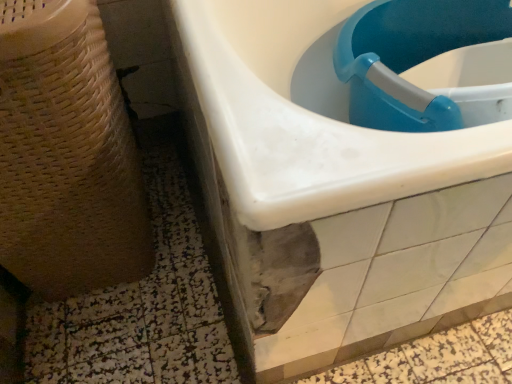
Question: From their relative heights in the image, would you say beige woven basket at left is taller or shorter than blue plastic sink at upper right, marked as the 2th sink in a right-to-left arrangement?

Choices:
 (A) short
 (B) tall

Answer: (B)

Question: In terms of width, does beige woven basket at left look wider or thinner when compared to blue plastic sink at upper right, which is the first sink in left-to-right order?

Choices:
 (A) wide
 (B) thin

Answer: (B)

Question: Based on their relative distances, which object is nearer to the blue plastic sink at upper right, the first sink positioned from the right?

Choices:
 (A) beige woven basket at left
 (B) blue plastic sink at upper right, marked as the 2th sink in a right-to-left arrangement

Answer: (B)

Question: Which is nearer to the blue plastic sink at upper right, which is the first sink in left-to-right order?

Choices:
 (A) blue plastic sink at upper right, the first sink positioned from the right
 (B) beige woven basket at left

Answer: (A)